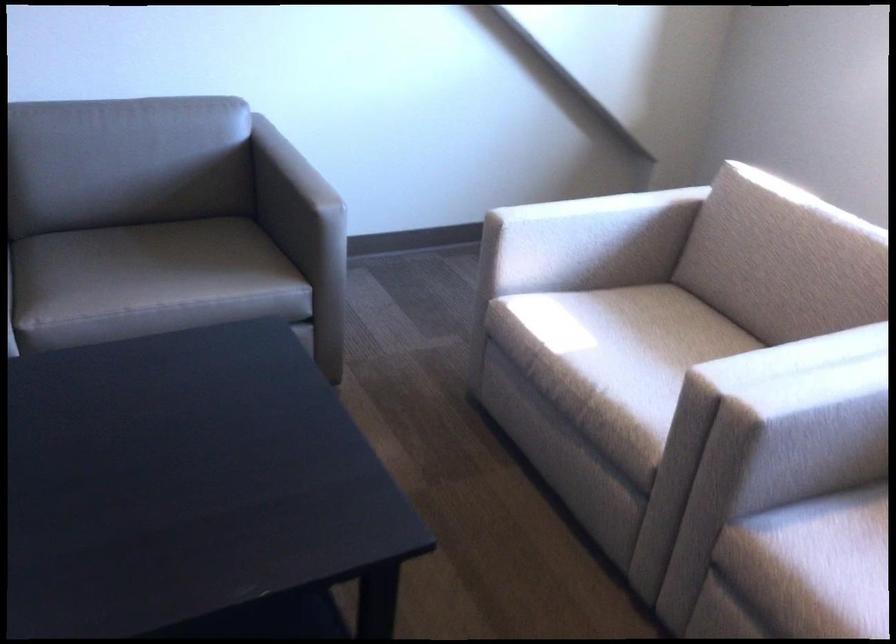
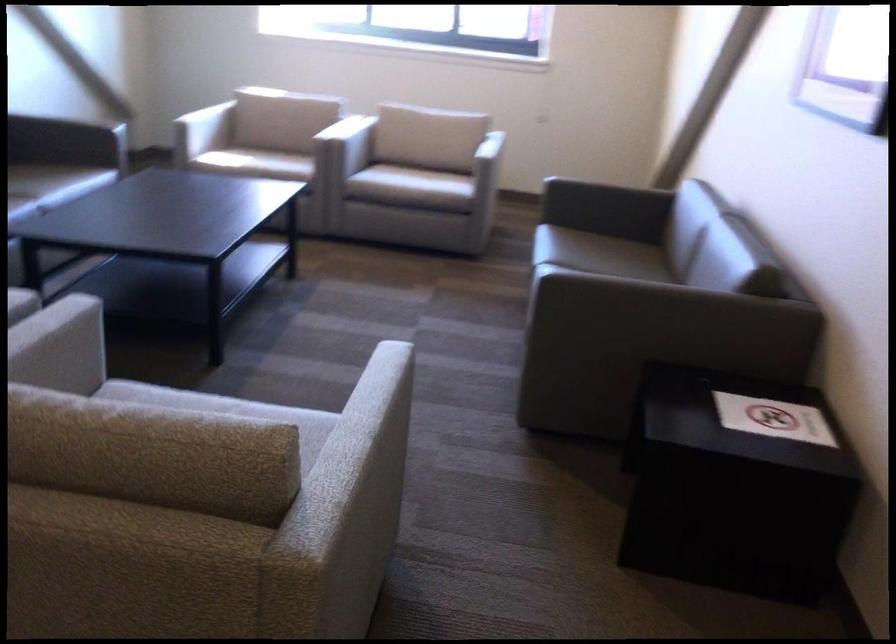
In the second image, find the point that corresponds to the point at 607,263 in the first image.

(202, 131)